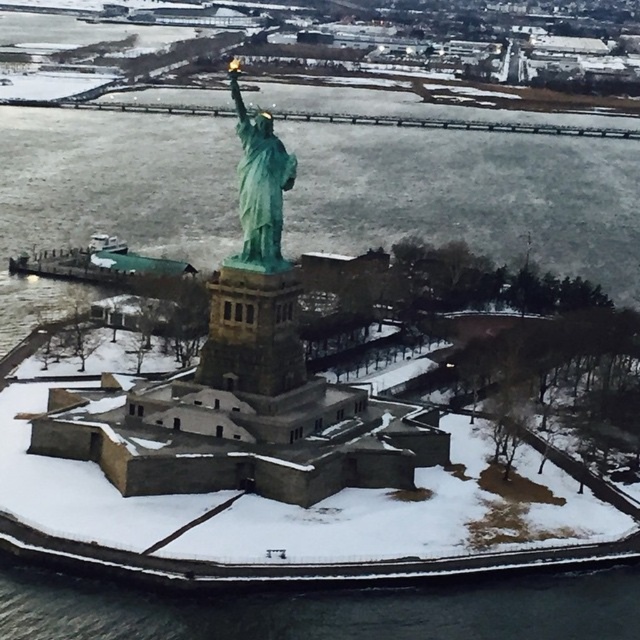
Does black water at lower center have a greater height compared to green patina statue at center?

No, black water at lower center is not taller than green patina statue at center.

Does black water at lower center have a smaller size compared to green patina statue at center?

Yes, black water at lower center is smaller than green patina statue at center.

Locate an element on the screen. This screenshot has width=640, height=640. black water at lower center is located at coordinates (323, 609).